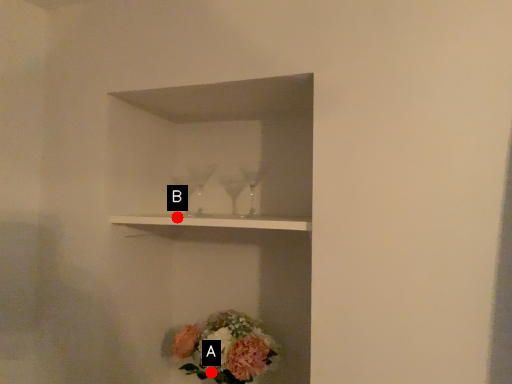
Question: Two points are circled on the image, labeled by A and B beside each circle. Which point is closer to the camera?

Choices:
 (A) A is closer
 (B) B is closer

Answer: (B)